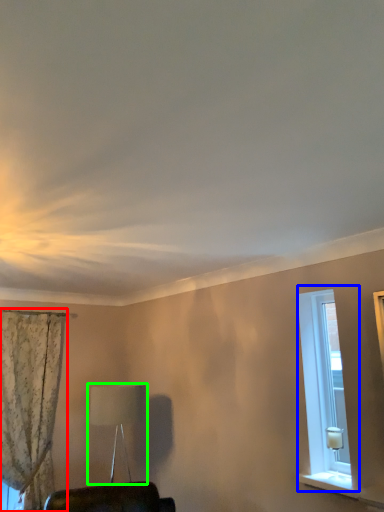
Question: Which object is the farthest from curtain (highlighted by a red box)? Choose among these: window (highlighted by a blue box) or table lamp (highlighted by a green box).

Choices:
 (A) window
 (B) table lamp

Answer: (A)